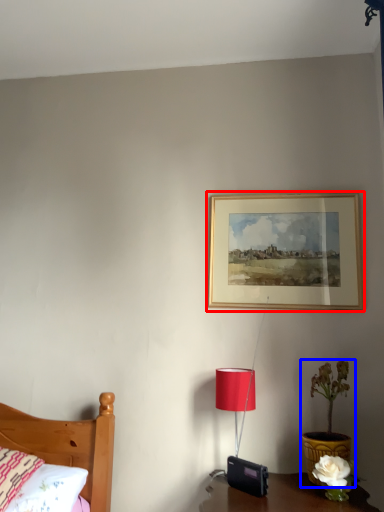
Question: Which point is further to the camera, picture frame (highlighted by a red box) or houseplant (highlighted by a blue box)?

Choices:
 (A) picture frame
 (B) houseplant

Answer: (A)